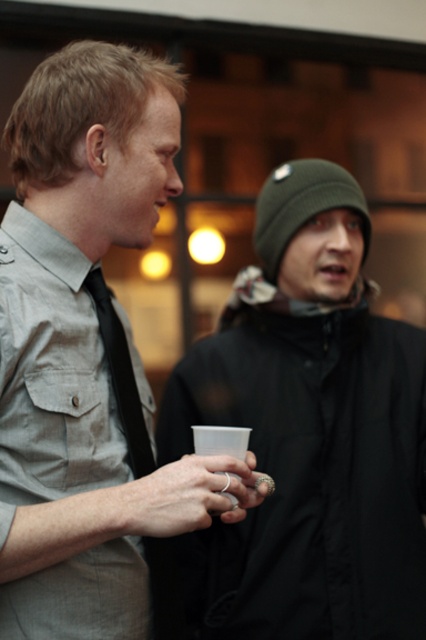
You are at an indoor event and want to greet the person wearing the dark green knit hat at upper right. Which direction should you walk to approach them from the matte gray shirt at center?

The matte gray shirt at center is in front of the dark green knit hat at upper right, so you should walk backward or to the side to approach the dark green knit hat at upper right from the matte gray shirt at center.

What are the coordinates of the dark green knit hat at upper right in the image?

The dark green knit hat at upper right is located at coordinates (308, 433).

You are a photographer trying to capture a candid shot of the two people in the scene. Your camera has a depth of field that can focus on objects within a 5 inch range. If you aim to focus on both the matte gray shirt at center and the black matte tie at left, will both be in focus?

The distance between the matte gray shirt at center and the black matte tie at left is 4.99 inches, which is within the 5 inch range of the camera. Therefore, both objects will be in focus.